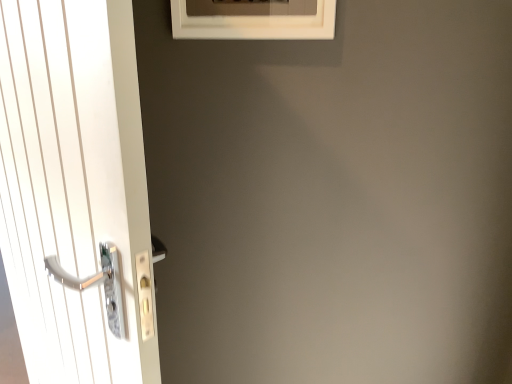
You are a GUI agent. You are given a task and a screenshot of the screen. Output one action in this format:
    pyautogui.click(x=<x>, y=<y>)
    Task: Click on the white matte frame at upper center
    
    Given the screenshot: What is the action you would take?
    pyautogui.click(x=253, y=19)

This screenshot has height=384, width=512. What do you see at coordinates (253, 19) in the screenshot?
I see `white matte frame at upper center` at bounding box center [253, 19].

Where is `white glossy door handle at left`? The image size is (512, 384). white glossy door handle at left is located at coordinates (75, 189).

Describe the element at coordinates (75, 189) in the screenshot. This screenshot has width=512, height=384. I see `white glossy door handle at left` at that location.

The height and width of the screenshot is (384, 512). Identify the location of white matte frame at upper center. [x=253, y=19].

Between white glossy door handle at left and white matte frame at upper center, which one appears on the right side from the viewer's perspective?

white matte frame at upper center is more to the right.

Which object is further away from the camera taking this photo, white glossy door handle at left or white matte frame at upper center?

white matte frame at upper center is further away from the camera.

Is point (41, 132) more distant than point (306, 26)?

No, it is not.

From the image's perspective, would you say white glossy door handle at left is positioned over white matte frame at upper center?

No.

From a real-world perspective, is white glossy door handle at left on white matte frame at upper center?

No, from a real-world perspective, white glossy door handle at left is not over white matte frame at upper center

Looking at their sizes, would you say white glossy door handle at left is wider or thinner than white matte frame at upper center?

Clearly, white glossy door handle at left has more width compared to white matte frame at upper center.

From their relative heights in the image, would you say white glossy door handle at left is taller or shorter than white matte frame at upper center?

Considering their sizes, white glossy door handle at left has more height than white matte frame at upper center.

Can you confirm if white glossy door handle at left is bigger than white matte frame at upper center?

Yes.

Which is correct: white glossy door handle at left is inside white matte frame at upper center, or outside of it?

white glossy door handle at left is spatially situated outside white matte frame at upper center.

Are white glossy door handle at left and white matte frame at upper center located far from each other?

Actually, white glossy door handle at left and white matte frame at upper center are a little close together.

From the picture: Is white glossy door handle at left turned away from white matte frame at upper center?

Yes, white glossy door handle at left is facing away from white matte frame at upper center.

How many degrees apart are the facing directions of white glossy door handle at left and white matte frame at upper center?

There is a 30.4-degree angle between the facing directions of white glossy door handle at left and white matte frame at upper center.

In order to click on door below the white matte frame at upper center (from a real-world perspective) in this screenshot , I will do `click(75, 189)`.

In the scene shown: Would you say white matte frame at upper center is to the left or to the right of white glossy door handle at left in the picture?

From the image, it's evident that white matte frame at upper center is to the right of white glossy door handle at left.

Between white matte frame at upper center and white glossy door handle at left, which one is positioned behind?

Answer: white matte frame at upper center is behind.

Which is more distant, (269, 34) or (77, 30)?

The point (269, 34) is farther from the camera.

From the image's perspective, relative to white glossy door handle at left, is white matte frame at upper center above or below?

Based on their image positions, white matte frame at upper center is located above white glossy door handle at left.

From a real-world perspective, between white matte frame at upper center and white glossy door handle at left, who is vertically higher?

white matte frame at upper center is physically above.

Is white matte frame at upper center wider than white glossy door handle at left?

No, white matte frame at upper center is not wider than white glossy door handle at left.

In the scene shown: In terms of height, does white matte frame at upper center look taller or shorter compared to white glossy door handle at left?

Clearly, white matte frame at upper center is shorter compared to white glossy door handle at left.

Which of these two, white matte frame at upper center or white glossy door handle at left, is bigger?

white glossy door handle at left is bigger.

Based on the photo, does white matte frame at upper center contain white glossy door handle at left?

No, white glossy door handle at left is located outside of white matte frame at upper center.

Is white matte frame at upper center far away from white glossy door handle at left?

That's not correct — white matte frame at upper center is a little close to white glossy door handle at left.

Could you tell me if white matte frame at upper center is facing white glossy door handle at left?

No, white matte frame at upper center is not oriented towards white glossy door handle at left.

Identify the location of window above the white glossy door handle at left (from the image's perspective). (253, 19).

Where is `door that is under the white matte frame at upper center (from a real-world perspective)`? The height and width of the screenshot is (384, 512). door that is under the white matte frame at upper center (from a real-world perspective) is located at coordinates (75, 189).

The image size is (512, 384). In order to click on window that is on the right side of white glossy door handle at left in this screenshot , I will do `click(253, 19)`.